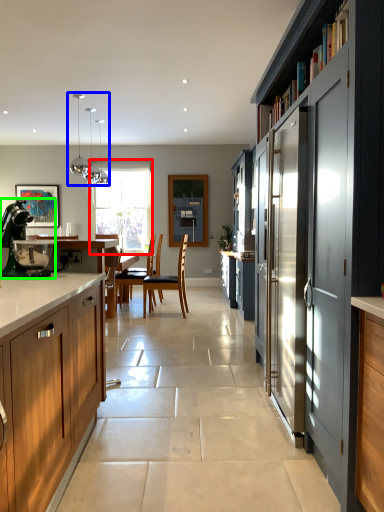
Question: Which object is positioned farthest from window (highlighted by a red box)? Select from light fixture (highlighted by a blue box) and kitchen appliance (highlighted by a green box).

Choices:
 (A) light fixture
 (B) kitchen appliance

Answer: (B)